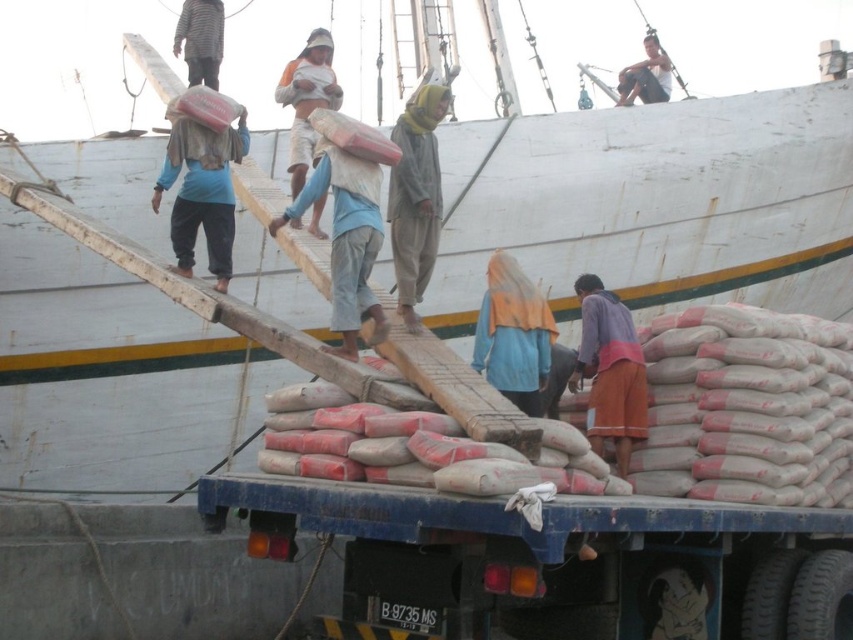
Question: Which point appears closest to the camera in this image?

Choices:
 (A) (398, 269)
 (B) (219, 276)

Answer: (A)

Question: Which point appears closest to the camera in this image?

Choices:
 (A) (480, 326)
 (B) (660, 88)

Answer: (A)

Question: Can you confirm if matte blue shirt at center is positioned above striped fabric shirt at upper left?

Choices:
 (A) yes
 (B) no

Answer: (B)

Question: Can you confirm if yellow fabric headscarf at center is positioned to the right of light brown wooden plank at upper center?

Choices:
 (A) yes
 (B) no

Answer: (B)

Question: Estimate the real-world distances between objects in this image. Which object is closer to the orange fabric headscarf at upper center?

Choices:
 (A) orange cotton shorts at lower right
 (B) light blue fabric bag at center
 (C) blue fabric headscarf at center
 (D) striped fabric shirt at upper left

Answer: (B)

Question: Does light blue fabric bag at center come behind yellow fabric headscarf at center?

Choices:
 (A) yes
 (B) no

Answer: (B)